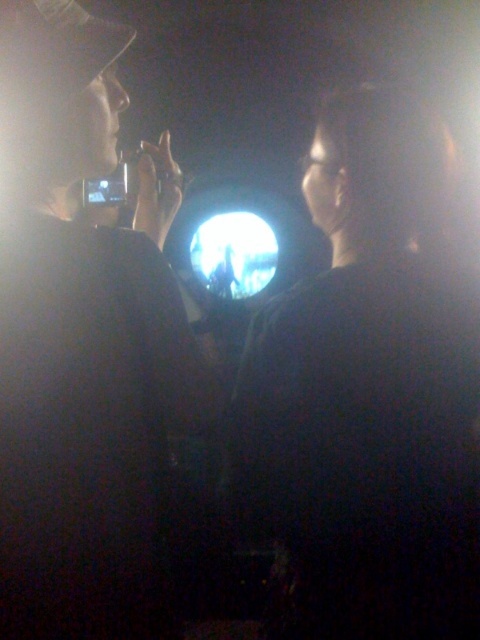
You are a photographer at the concert. You need to capture a photo where both the black matte face at center and the matte black phone at left are visible. Which object should you adjust the camera focus to prioritize to ensure both are in the frame?

The black matte face at center is wider than the matte black phone at left, so you should adjust the camera focus to prioritize the black matte face at center to ensure both are in the frame.

You are a photographer trying to capture the best shot of the concert. You notice the black matte face at center and the matte black phone at left in your viewfinder. Which object should you focus on if you want to prioritize capturing the larger subject?

The matte black phone at left is larger than the black matte face at center, so you should focus on the matte black phone at left to capture the larger subject.